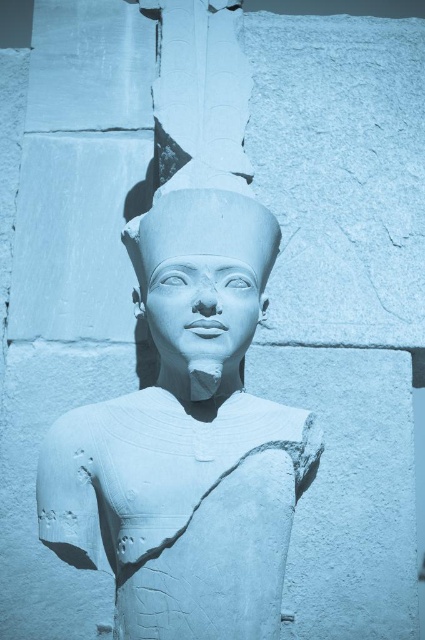
Can you confirm if white stone statue at center is shorter than white stone head at center?

No.

This screenshot has height=640, width=425. What do you see at coordinates (187, 440) in the screenshot?
I see `white stone statue at center` at bounding box center [187, 440].

Locate an element on the screen. The image size is (425, 640). white stone statue at center is located at coordinates (187, 440).

Identify the location of white stone statue at center. (187, 440).